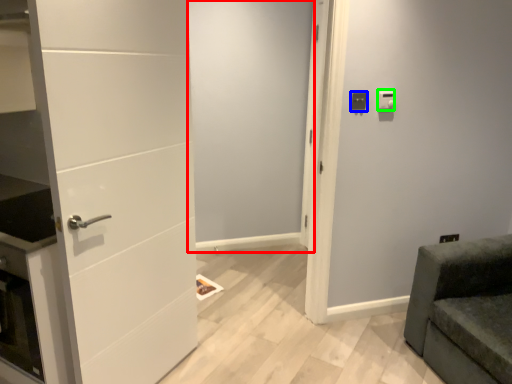
Question: Based on their relative distances, which object is nearer to screen door (highlighted by a red box)? Choose from light switch (highlighted by a blue box) and light switch (highlighted by a green box).

Choices:
 (A) light switch
 (B) light switch

Answer: (A)